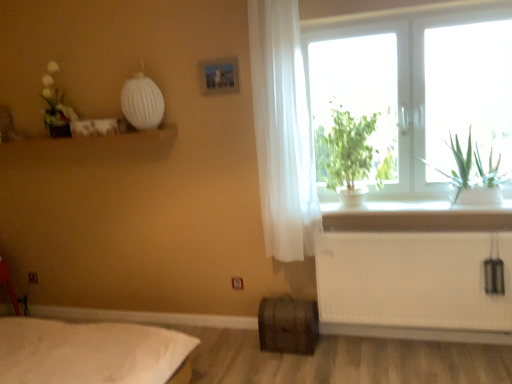
Question: Is white sheer curtain at right oriented towards rustic wooden barrel at lower center?

Choices:
 (A) yes
 (B) no

Answer: (B)

Question: Is white sheer curtain at right shorter than rustic wooden barrel at lower center?

Choices:
 (A) yes
 (B) no

Answer: (B)

Question: Can you confirm if white sheer curtain at right is smaller than rustic wooden barrel at lower center?

Choices:
 (A) no
 (B) yes

Answer: (A)

Question: Is white sheer curtain at right placed right next to rustic wooden barrel at lower center?

Choices:
 (A) yes
 (B) no

Answer: (B)

Question: Is the position of white sheer curtain at right more distant than that of rustic wooden barrel at lower center?

Choices:
 (A) yes
 (B) no

Answer: (B)

Question: Considering the relative sizes of white sheer curtain at right and rustic wooden barrel at lower center in the image provided, is white sheer curtain at right taller than rustic wooden barrel at lower center?

Choices:
 (A) no
 (B) yes

Answer: (B)

Question: Can you confirm if white glass window at upper right is smaller than rustic wooden barrel at lower center?

Choices:
 (A) no
 (B) yes

Answer: (A)

Question: Is white glass window at upper right positioned with its back to rustic wooden barrel at lower center?

Choices:
 (A) no
 (B) yes

Answer: (A)

Question: From a real-world perspective, is white glass window at upper right on rustic wooden barrel at lower center?

Choices:
 (A) no
 (B) yes

Answer: (B)

Question: Can you confirm if white glass window at upper right is thinner than rustic wooden barrel at lower center?

Choices:
 (A) no
 (B) yes

Answer: (B)

Question: From the image's perspective, would you say white glass window at upper right is shown under rustic wooden barrel at lower center?

Choices:
 (A) yes
 (B) no

Answer: (B)

Question: Considering the relative positions of white glass window at upper right and rustic wooden barrel at lower center in the image provided, is white glass window at upper right to the left of rustic wooden barrel at lower center from the viewer's perspective?

Choices:
 (A) yes
 (B) no

Answer: (B)

Question: From the image's perspective, is green leafy plant at window located above green leafy plant at window?

Choices:
 (A) no
 (B) yes

Answer: (A)